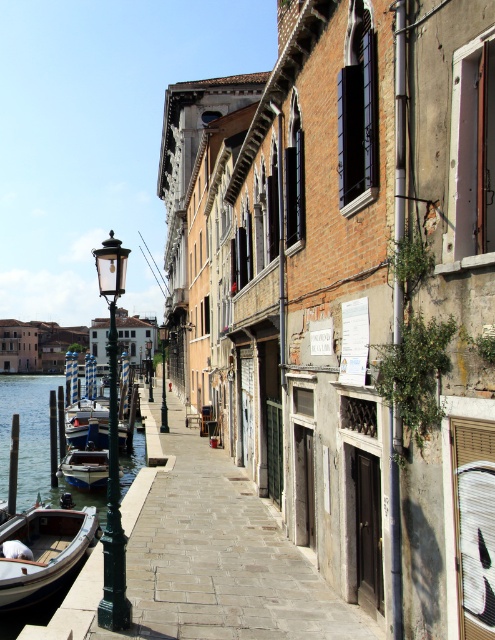
You are a tourist standing on the cobblestone walkway in Venice. You see the clear water at dock left and the wooden boat at lower left. Which one appears taller from your viewpoint?

The clear water at dock left appears taller than the wooden boat at lower left from your viewpoint.

You are standing on the cobblestone walkway in Venice and want to find the clear water at dock left. Which direction should you look to locate the point marked by coordinates [35,444]?

The clear water at dock left is located at the point marked by coordinates [35,444], so you should look towards the left side of the walkway where the dock is positioned.

You are a tourist standing on the cobblestone walkway in Venice. You see the wooden boat at lower left and the green painted metal streetlamp at left. Which object is closer to you?

The wooden boat at lower left is positioned under the green painted metal streetlamp at left, so the boat is closer to you.